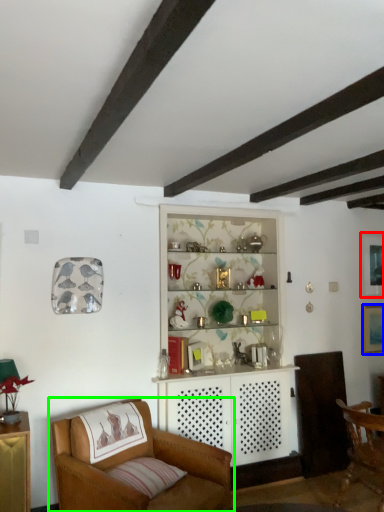
Question: Considering the real-world distances, which object is farthest from picture frame (highlighted by a red box)? picture frame (highlighted by a blue box) or chair (highlighted by a green box)?

Choices:
 (A) picture frame
 (B) chair

Answer: (B)